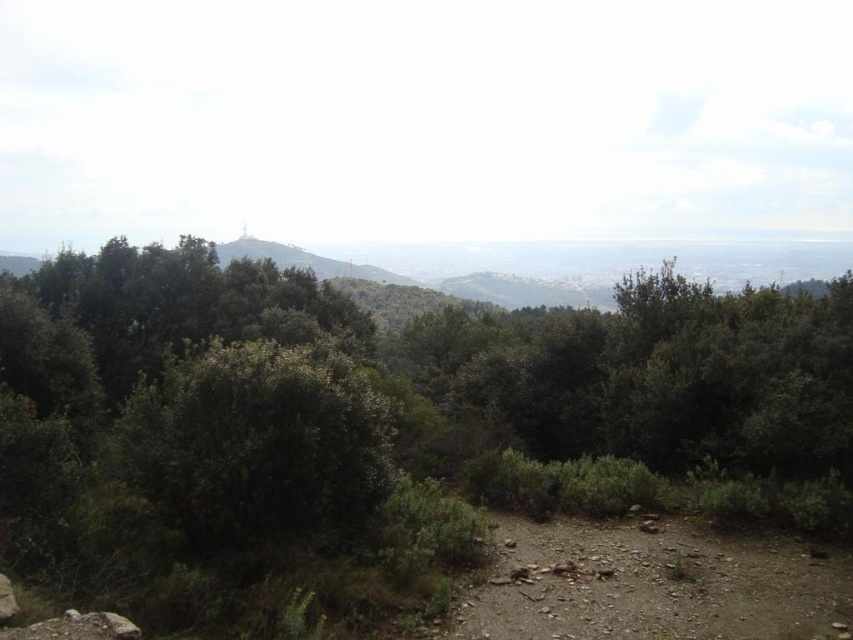
Question: Is green leafy forest at center below brown rocky dirt track at lower right?

Choices:
 (A) no
 (B) yes

Answer: (A)

Question: Which point is closer to the camera?

Choices:
 (A) (795, 544)
 (B) (334, 355)

Answer: (B)

Question: Which object appears farthest from the camera in this image?

Choices:
 (A) brown rocky dirt track at lower right
 (B) green leafy forest at center

Answer: (A)

Question: Does green leafy forest at center come in front of brown rocky dirt track at lower right?

Choices:
 (A) yes
 (B) no

Answer: (A)

Question: Can you confirm if green leafy forest at center is wider than brown rocky dirt track at lower right?

Choices:
 (A) yes
 (B) no

Answer: (A)